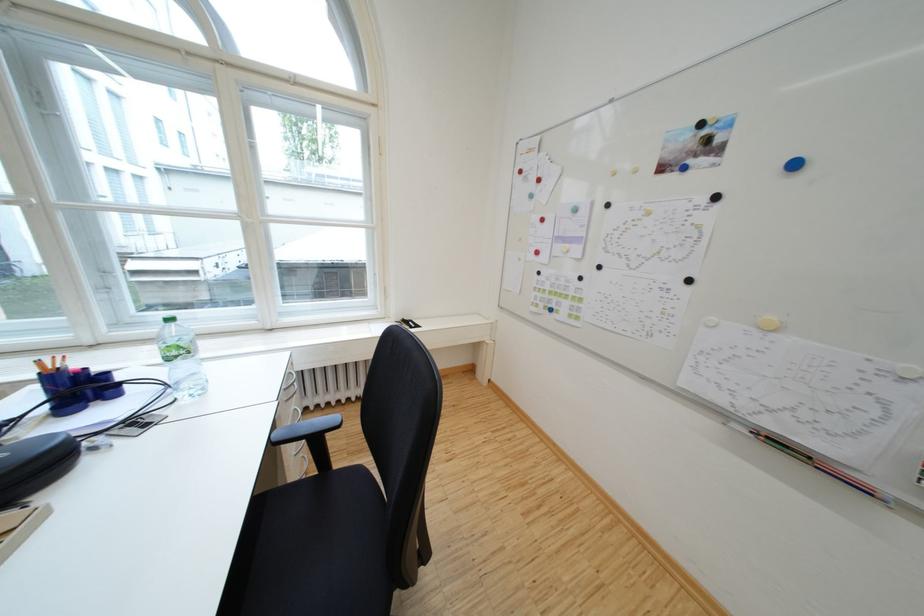
Describe the element at coordinates (319, 548) in the screenshot. I see `the black sitting surface` at that location.